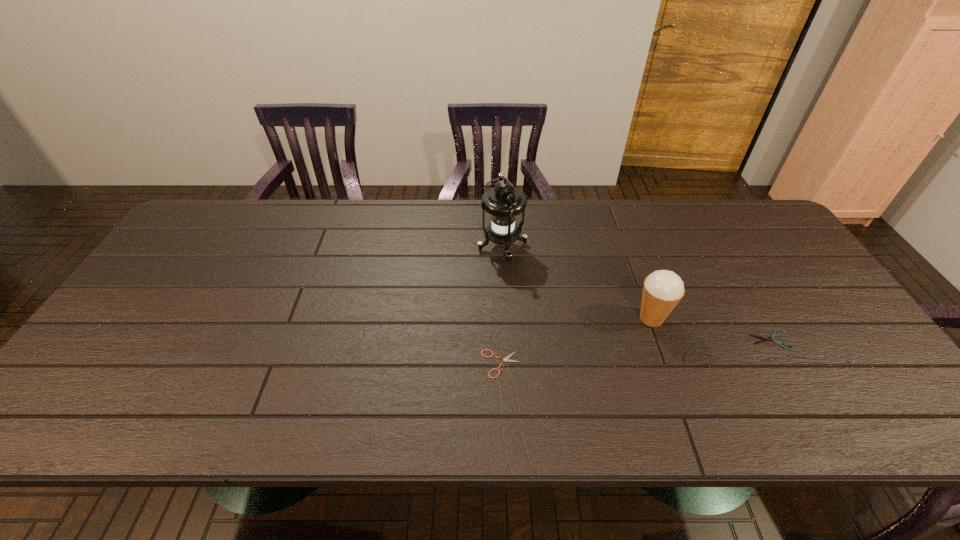
This screenshot has height=540, width=960. I want to click on object that is at the far edge, so click(x=504, y=202).

Where is `object that is positioned at the right edge`? object that is positioned at the right edge is located at coordinates (773, 335).

Where is `blank space at the far edge of the desktop`? The image size is (960, 540). blank space at the far edge of the desktop is located at coordinates (455, 230).

Where is `vacant space at the near edge of the desktop`? vacant space at the near edge of the desktop is located at coordinates (592, 403).

In the image, there is a desktop. At what (x,y) coordinates should I click in order to perform the action: click on blank space at the left edge. Please return your answer as a coordinate pair (x, y). This screenshot has height=540, width=960. Looking at the image, I should click on (102, 371).

Identify the location of vacant space at the right edge. (858, 361).

I want to click on vacant space at the far right corner of the desktop, so click(749, 205).

Where is `free space between the right shears and the left shears`? This screenshot has width=960, height=540. free space between the right shears and the left shears is located at coordinates (636, 352).

Find the location of a particular element. Image resolution: width=960 pixels, height=540 pixels. free point between the rightmost object and the left shears is located at coordinates (636, 352).

The width and height of the screenshot is (960, 540). In order to click on blank region between the rightmost object and the left shears in this screenshot , I will do `click(636, 352)`.